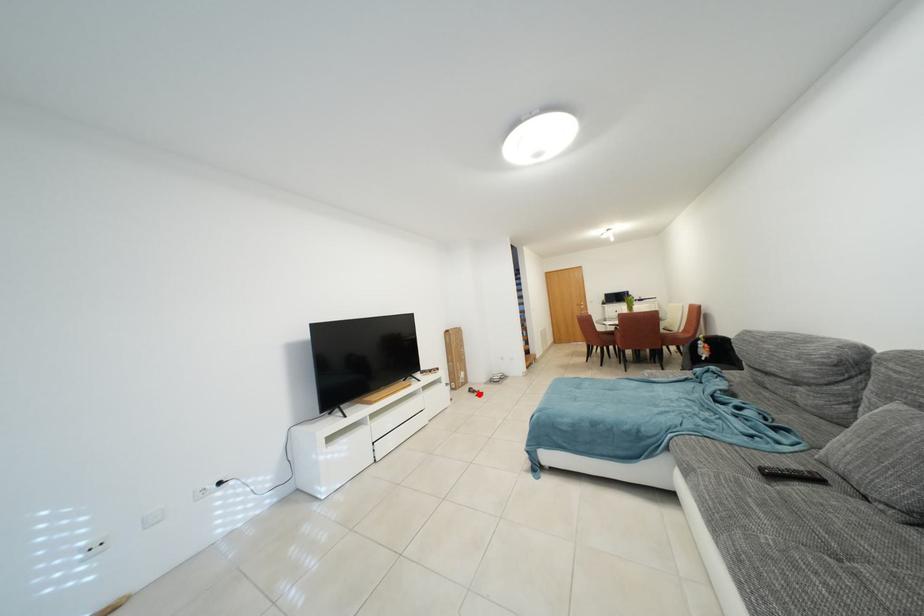
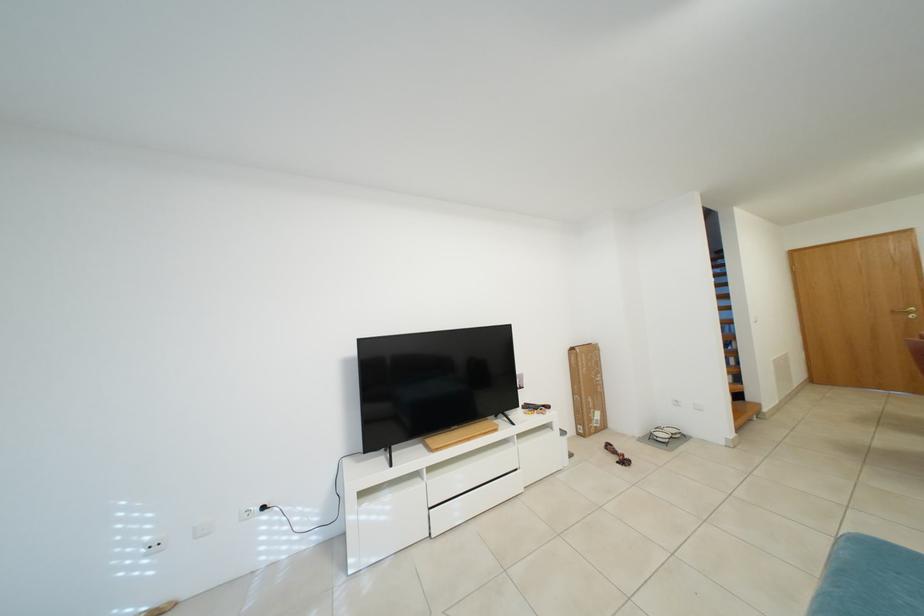
In the second image, find the point that corresponds to the highlighted location in the first image.

(617, 451)